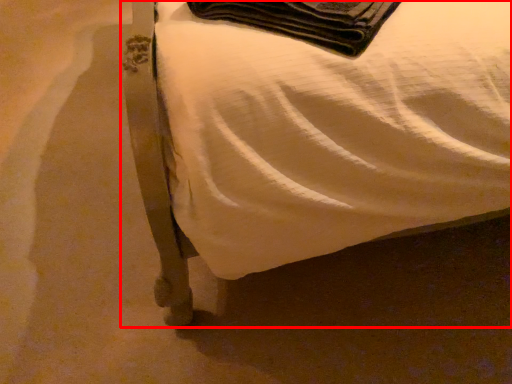
Question: From the image's perspective, what is the correct spatial positioning of furniture (annotated by the red box) in reference to blanket?

Choices:
 (A) above
 (B) below

Answer: (A)